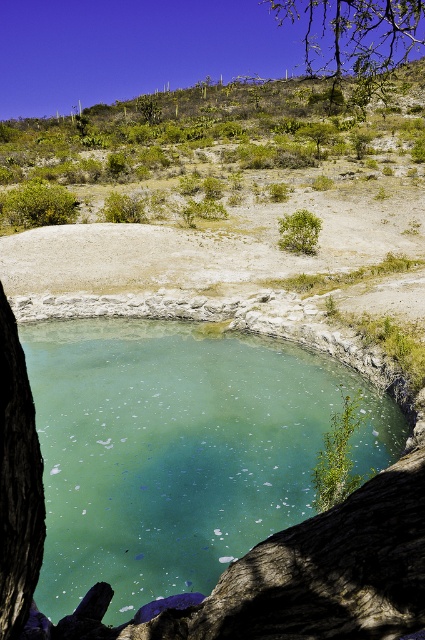
In the scene shown: You are standing at the edge of the turquoise pool and want to walk to the green leafy tree at upper right. Which direction should you head from the green leafy bush at center?

The green leafy tree at upper right is to the right of the green leafy bush at center, so you should head to the right direction from the green leafy bush at center to reach the green leafy tree at upper right.

You are standing at the edge of the pool and want to reach the green leafy tree at upper right. Which direction should you walk to avoid the dark brown textured tree trunk at left?

To reach the green leafy tree at upper right while avoiding the dark brown textured tree trunk at left, you should walk towards the upper right direction since the dark brown textured tree trunk at left is located below it.

You are standing at the edge of the turquoise pool in the arid landscape and notice two points marked in the scene. Which of the two points, point (164, 552) or point (294, 228), is closer to your current position?

Point (164, 552) is closer to the camera than point (294, 228), so it is closer to your current position at the edge of the turquoise pool.